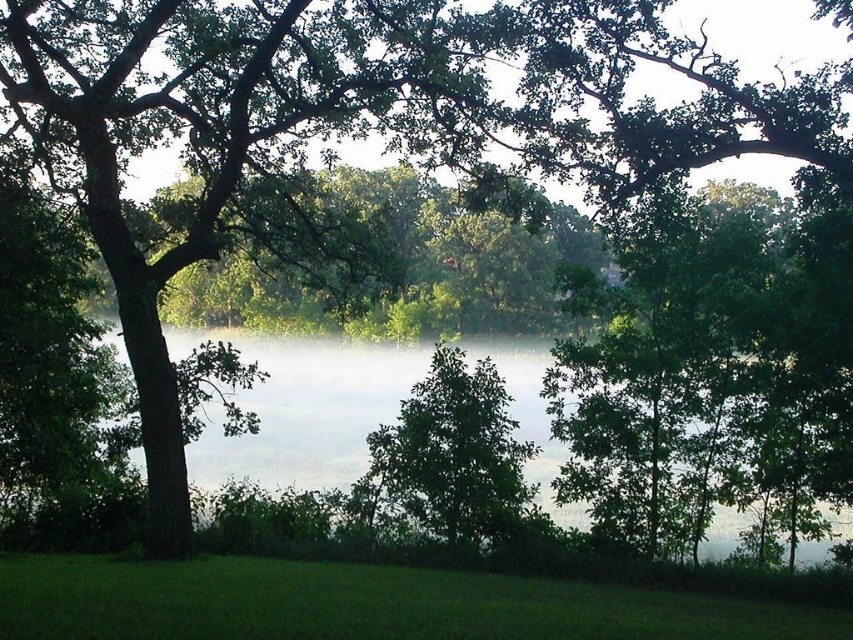
Question: Does misty water at center appear under green leafy tree at center?

Choices:
 (A) yes
 (B) no

Answer: (B)

Question: Which point is closer to the camera taking this photo?

Choices:
 (A) (550, 342)
 (B) (386, 444)

Answer: (B)

Question: Is misty water at center bigger than green leafy tree at center?

Choices:
 (A) yes
 (B) no

Answer: (A)

Question: Can you confirm if misty water at center is positioned below green leafy tree at center?

Choices:
 (A) no
 (B) yes

Answer: (A)

Question: Which of the following is the farthest from the observer?

Choices:
 (A) (300, 442)
 (B) (462, 513)

Answer: (A)